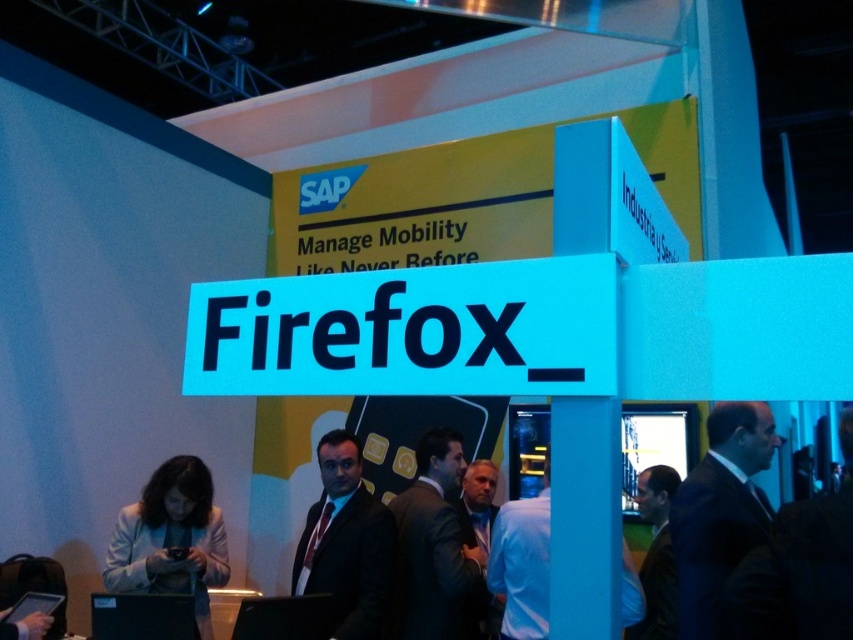
Question: Which point is closer to the camera?

Choices:
 (A) (766, 435)
 (B) (460, 282)
 (C) (390, 586)

Answer: (B)

Question: Is dark blue suit at center behind blue fabric shirt at center?

Choices:
 (A) yes
 (B) no

Answer: (B)

Question: Which of the following is the farthest from the observer?

Choices:
 (A) dark brown suit at center
 (B) dark blue suit at center

Answer: (A)

Question: Which object appears farthest from the camera in this image?

Choices:
 (A) dark brown suit at center
 (B) blue glossy sign at center
 (C) dark blue suit at center

Answer: (A)

Question: Does dark blue suit at center have a larger size compared to dark suit at center?

Choices:
 (A) no
 (B) yes

Answer: (A)

Question: Can you confirm if blue glossy sign at center is wider than dark suit at center?

Choices:
 (A) no
 (B) yes

Answer: (B)